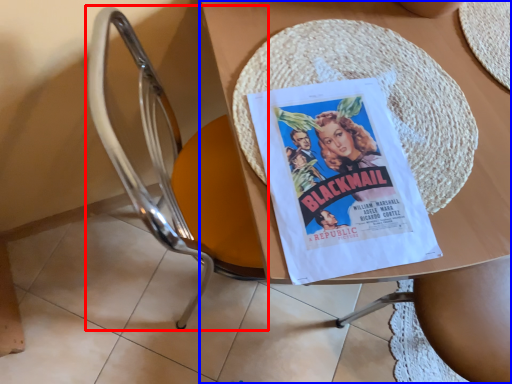
Question: Which of the following is the farthest to the observer, chair (highlighted by a red box) or table (highlighted by a blue box)?

Choices:
 (A) chair
 (B) table

Answer: (B)